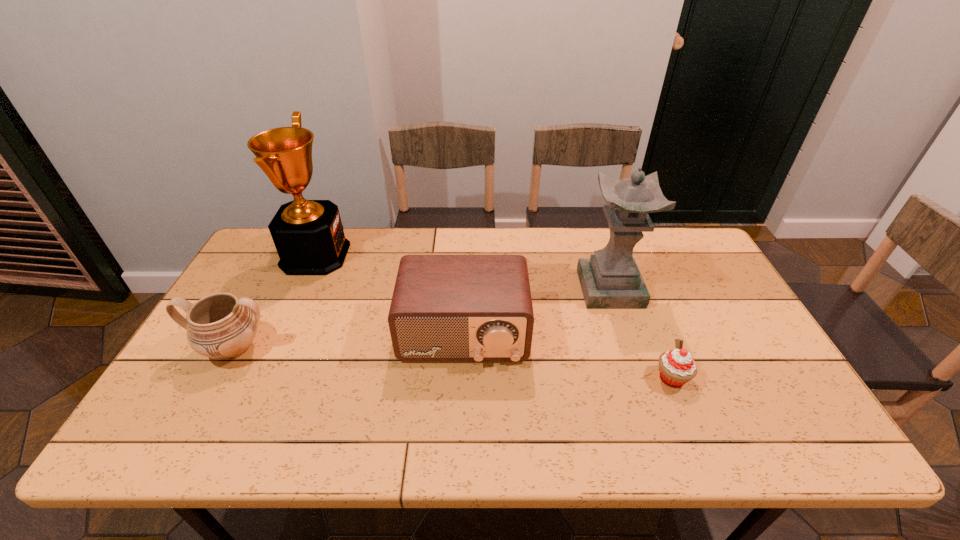
Identify the location of vacant area that lies between the sculpture and the third object from left to right. Image resolution: width=960 pixels, height=540 pixels. 537,312.

Locate an element on the screen. Image resolution: width=960 pixels, height=540 pixels. free space between the trophy cup and the radio receiver is located at coordinates (390, 295).

The height and width of the screenshot is (540, 960). Find the location of `free space that is in between the urn and the cupcake`. free space that is in between the urn and the cupcake is located at coordinates (453, 363).

Where is `free space that is in between the radio receiver and the cupcake`? This screenshot has width=960, height=540. free space that is in between the radio receiver and the cupcake is located at coordinates (567, 356).

This screenshot has width=960, height=540. I want to click on vacant area between the sculpture and the third object from right to left, so point(537,312).

Locate an element on the screen. free area in between the radio receiver and the urn is located at coordinates (x=348, y=341).

Select which object is the closest to the urn. Please provide its 2D coordinates. Your answer should be formatted as a tuple, i.e. [(x, y)], where the tuple contains the x and y coordinates of a point satisfying the conditions above.

[(308, 235)]

The width and height of the screenshot is (960, 540). Identify the location of object that is the fourth closest to the sculpture. (221, 326).

The height and width of the screenshot is (540, 960). In order to click on free region that satisfies the following two spatial constraints: 1. on the front panel of the cupcake; 2. on the left side of the radio receiver in this screenshot , I will do `click(462, 378)`.

In order to click on free spot that satisfies the following two spatial constraints: 1. on the front-facing side of the shortest object; 2. on the right side of the urn in this screenshot , I will do `click(218, 378)`.